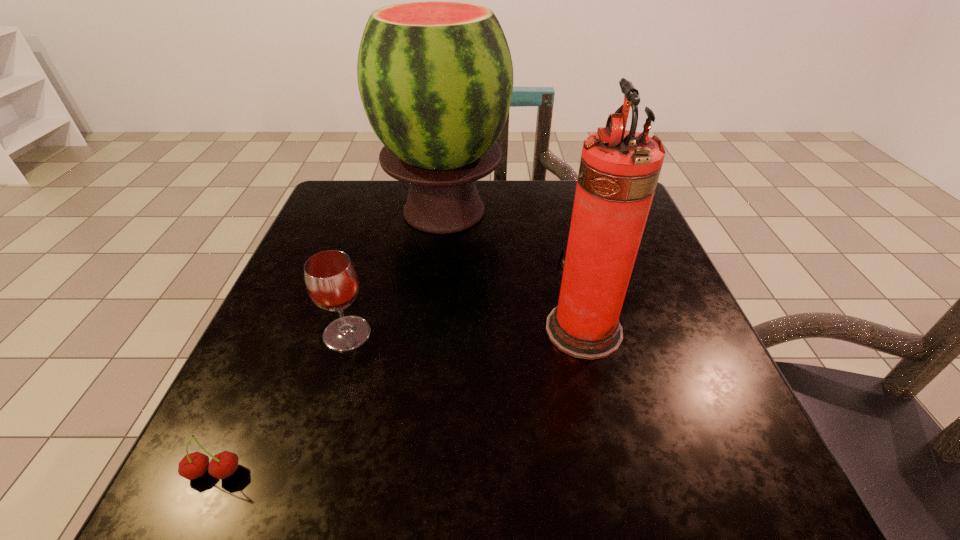
Find the location of a particular element. watermelon is located at coordinates (435, 78).

Find the location of a particular element. This screenshot has height=540, width=960. fire extinguisher is located at coordinates (619, 169).

Locate an element on the screen. This screenshot has height=540, width=960. the third tallest object is located at coordinates (331, 280).

At what (x,y) coordinates should I click in order to perform the action: click on the shortest object. Please return your answer as a coordinate pair (x, y). Image resolution: width=960 pixels, height=540 pixels. Looking at the image, I should click on (194, 465).

What are the coordinates of `cherry` in the screenshot? It's located at (194, 465).

Image resolution: width=960 pixels, height=540 pixels. I want to click on vacant position located 0.170m on the right of the watermelon, so (x=576, y=211).

This screenshot has width=960, height=540. Find the location of `blank space located at the discharge end of the fire extinguisher`. blank space located at the discharge end of the fire extinguisher is located at coordinates (369, 329).

Image resolution: width=960 pixels, height=540 pixels. What are the coordinates of `vacant space positioned 0.180m at the discharge end of the fire extinguisher` in the screenshot? It's located at (446, 329).

This screenshot has width=960, height=540. In order to click on vacant space located at the discharge end of the fire extinguisher in this screenshot , I will do `click(473, 329)`.

This screenshot has width=960, height=540. In order to click on free space located 0.190m on the front of the wineglass in this screenshot , I will do `click(309, 459)`.